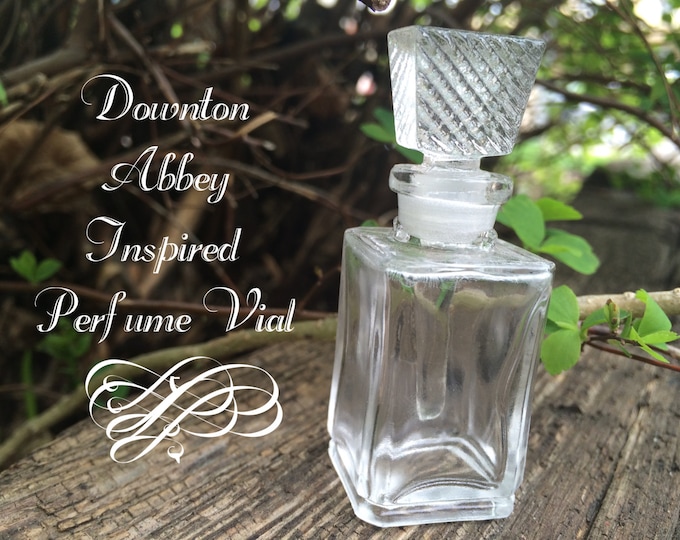
Find the location of a particular element. This screenshot has height=540, width=680. ornamentation is located at coordinates (214, 400).